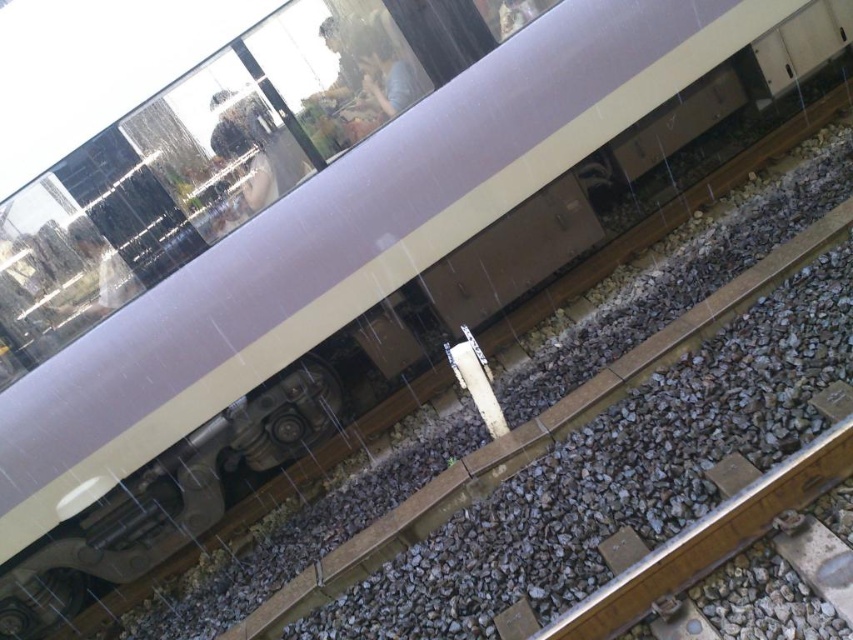
Looking at this image, which is above, transparent glass train window at upper center or gray gravel at lower right?

Positioned higher is transparent glass train window at upper center.

Does transparent glass train window at upper center have a lesser width compared to gray gravel at lower right?

No.

Which is in front, point (207, 99) or point (610, 611)?

Point (610, 611) is in front.

This screenshot has height=640, width=853. Find the location of `transparent glass train window at upper center`. transparent glass train window at upper center is located at coordinates (219, 154).